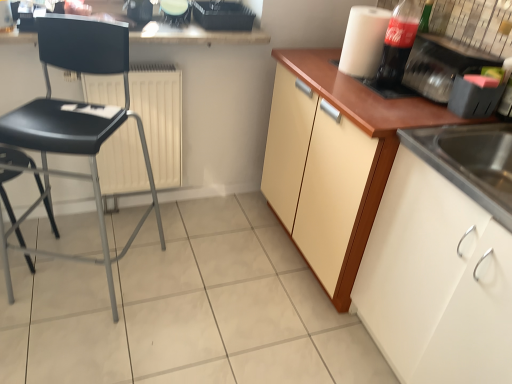
Locate an element on the screen. The width and height of the screenshot is (512, 384). free space that is to the left of translucent plastic bottle at upper right is located at coordinates (339, 82).